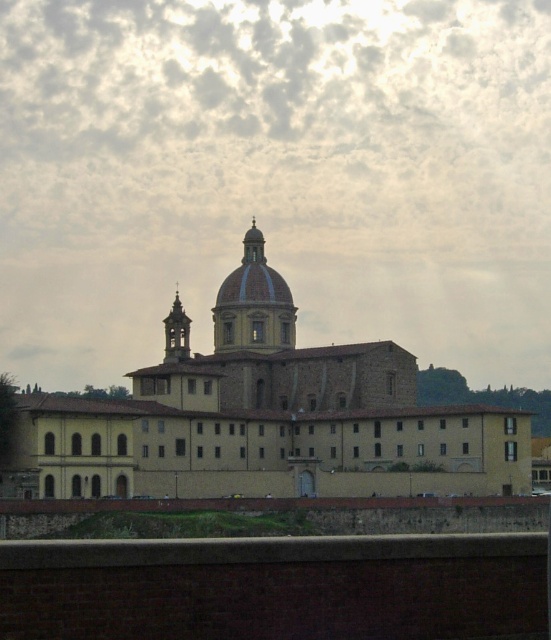
Looking at this image, who is positioned more to the right, yellow matte building at center or gold textured bell tower at center?

yellow matte building at center

Is yellow matte building at center bigger than gold textured bell tower at center?

Indeed, yellow matte building at center has a larger size compared to gold textured bell tower at center.

Is point (391, 460) behind point (171, 310)?

That is False.

Image resolution: width=551 pixels, height=640 pixels. I want to click on yellow matte building at center, so click(x=268, y=419).

Looking at this image, is cloudy sky at upper center above yellow matte building at center?

Yes, cloudy sky at upper center is above yellow matte building at center.

Measure the distance between point (8, 104) and camera.

The distance of point (8, 104) from camera is 230.22 meters.

This screenshot has height=640, width=551. Describe the element at coordinates (276, 177) in the screenshot. I see `cloudy sky at upper center` at that location.

The width and height of the screenshot is (551, 640). Find the location of `cloudy sky at upper center`. cloudy sky at upper center is located at coordinates (276, 177).

In order to click on yellow matte building at center in this screenshot , I will do `click(268, 419)`.

Is yellow matte building at center further to the viewer compared to matte brown dome at center?

No.

Does point (446, 436) lie behind point (224, 326)?

That is False.

The width and height of the screenshot is (551, 640). Identify the location of yellow matte building at center. (268, 419).